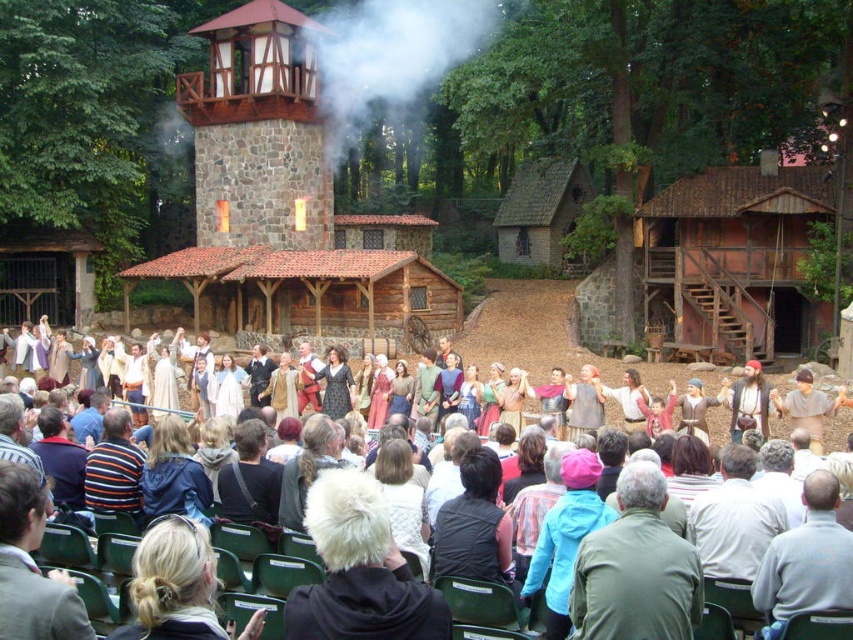
Question: Does white cotton clothing at center appear over matte black dress at center?

Choices:
 (A) yes
 (B) no

Answer: (A)

Question: Which point is farther to the camera?

Choices:
 (A) green fabric jacket at center
 (B) matte brown armor at center
 (C) brown leather hat at center
 (D) blue jacket at center

Answer: (B)

Question: Which of the following is the farthest from the observer?

Choices:
 (A) (21, 508)
 (B) (572, 358)
 (C) (320, 429)
 (D) (514, 392)

Answer: (B)

Question: Can you confirm if bearded man with leather vest at center is positioned above wooden pirate hat at center?

Choices:
 (A) yes
 (B) no

Answer: (A)

Question: Among these points, which one is farthest from the camera?

Choices:
 (A) (386, 412)
 (B) (250, 477)
 (C) (469, 355)

Answer: (C)

Question: Can you confirm if brown leather vest at center is thinner than matte brown dress at center?

Choices:
 (A) no
 (B) yes

Answer: (A)